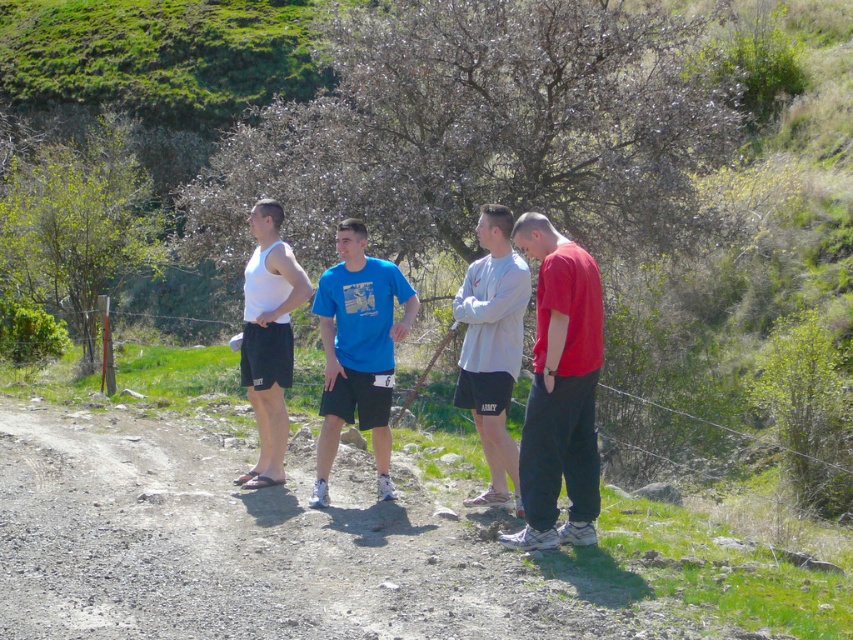
Measure the distance from matte red shirt at center to white matte tank top at center.

7.51 feet

Measure the distance between matte red shirt at center and camera.

7.18 meters

Is point (569, 381) behind point (283, 273)?

That is False.

The height and width of the screenshot is (640, 853). In order to click on matte red shirt at center in this screenshot , I will do `click(560, 390)`.

Is blue cotton t-shirt at center behind white matte tank top at center?

No, it is in front of white matte tank top at center.

At what (x,y) coordinates should I click in order to perform the action: click on blue cotton t-shirt at center. Please return your answer as a coordinate pair (x, y). The width and height of the screenshot is (853, 640). Looking at the image, I should click on (358, 349).

Who is shorter, blue cotton t-shirt at center or gray matte shorts at center?

blue cotton t-shirt at center is shorter.

Can you confirm if blue cotton t-shirt at center is positioned to the right of gray matte shorts at center?

Incorrect, blue cotton t-shirt at center is not on the right side of gray matte shorts at center.

Describe the element at coordinates (358, 349) in the screenshot. I see `blue cotton t-shirt at center` at that location.

The image size is (853, 640). What are the coordinates of `blue cotton t-shirt at center` in the screenshot? It's located at (358, 349).